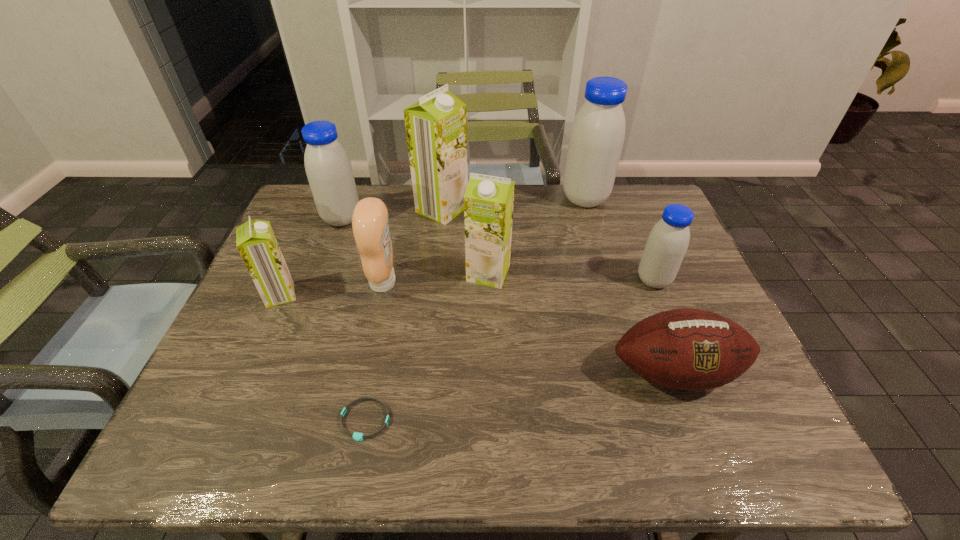
In order to click on free space located on the back of the football (American) in this screenshot , I will do `click(652, 310)`.

Image resolution: width=960 pixels, height=540 pixels. Find the location of `object that is at the near edge`. object that is at the near edge is located at coordinates (356, 436).

The height and width of the screenshot is (540, 960). I want to click on soya milk that is at the right edge, so click(x=667, y=243).

Identify the location of football (American) at the right edge. (687, 349).

Find the location of `object that is at the far left corner`. object that is at the far left corner is located at coordinates (328, 168).

You are a GUI agent. You are given a task and a screenshot of the screen. Output one action in this format:
    pyautogui.click(x=<x>, y=<y>)
    Task: Click on the free space at the near edge
    The height and width of the screenshot is (540, 960).
    Given the screenshot: What is the action you would take?
    pyautogui.click(x=519, y=458)

Where is `vacant space at the left edge of the desktop`? The width and height of the screenshot is (960, 540). vacant space at the left edge of the desktop is located at coordinates 257,328.

This screenshot has width=960, height=540. Identify the location of vacant space at the right edge of the desktop. (716, 310).

In the image, there is a desktop. Identify the location of vacant region at the near left corner. This screenshot has height=540, width=960. (202, 430).

Image resolution: width=960 pixels, height=540 pixels. I want to click on blank region between the second biggest blue soya milk and the shortest object, so pos(353,320).